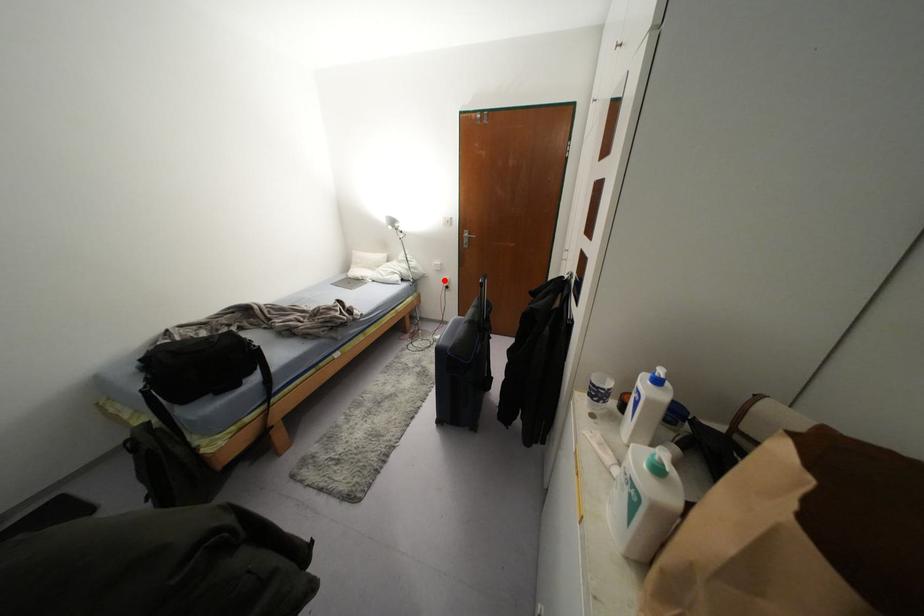
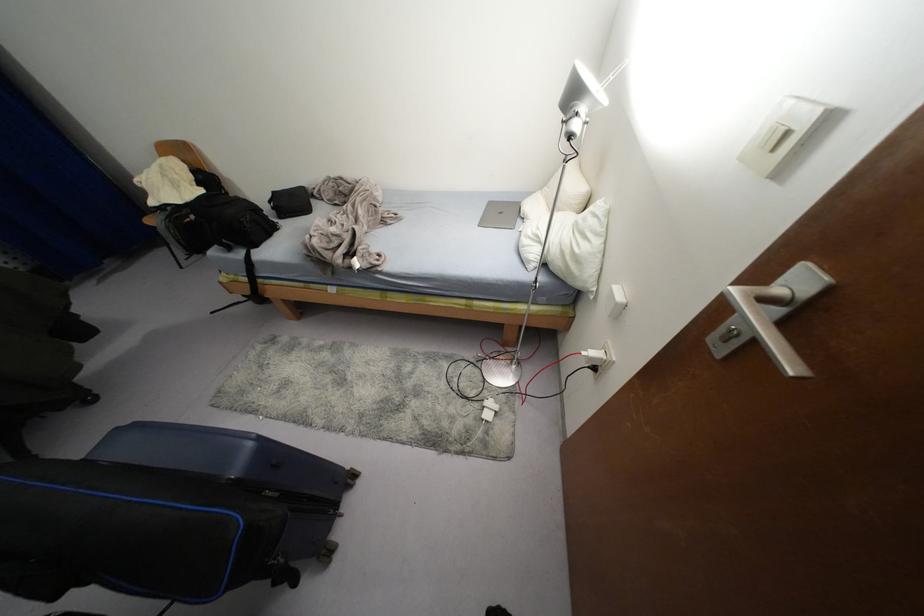
The point at the highlighted location is marked in the first image. Where is the corresponding point in the second image?

(592, 353)